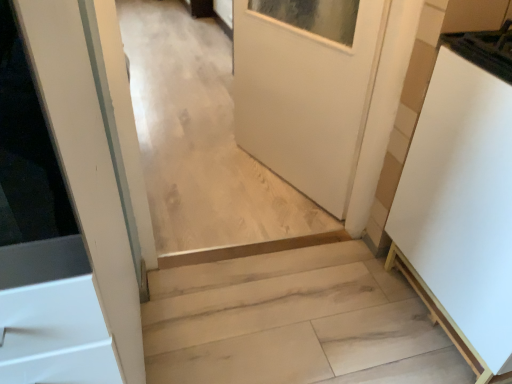
The height and width of the screenshot is (384, 512). I want to click on vacant area on top of light wood stairs at center (from a real-world perspective), so [x=287, y=329].